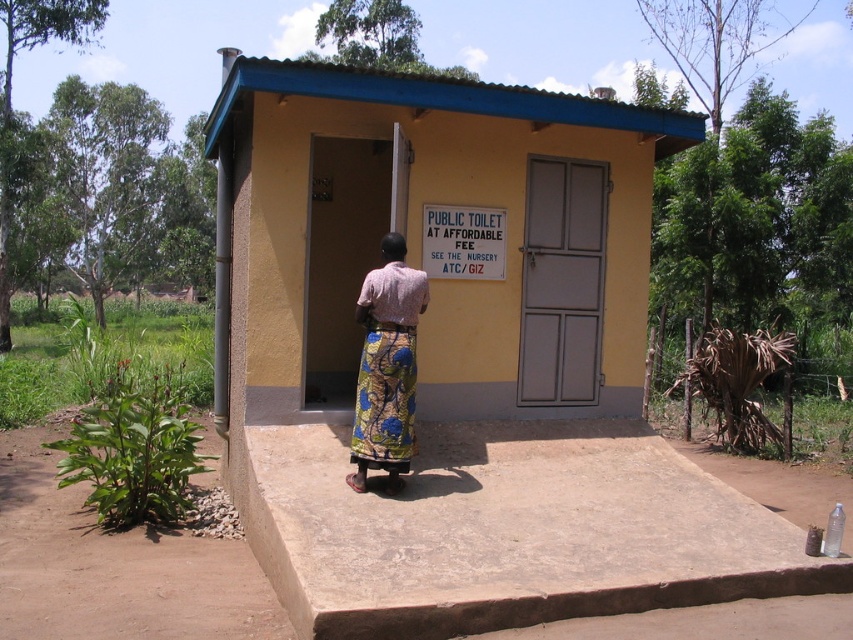
You are a photographer standing at the camera position. You want to capture a photo of the printed fabric skirt at center without including the public toilet building in the background. Is it possible to do so while maintaining the subject in focus?

The printed fabric skirt at center is 17.39 feet away from the camera. Since the distance between the subject and the background is significant, it is possible to achieve a shallow depth of field, blurring the background and keeping the printed fabric skirt at center in focus.

You are a photographer trying to capture the public toilet building. You notice the printed fabric skirt at center and the white plastic sign at upper center in your frame. Which object should you adjust your camera angle to focus on if you want to highlight the taller one?

The printed fabric skirt at center has a greater height compared to the white plastic sign at upper center, so you should focus on the printed fabric skirt at center to highlight the taller object.

You are a photographer trying to capture the yellow matte public toilet at center and the printed fabric skirt at center in the same frame. Based on their sizes, which object would appear smaller in your photo?

The yellow matte public toilet at center appears smaller in the photo because it has a lesser height compared to the printed fabric skirt at center.